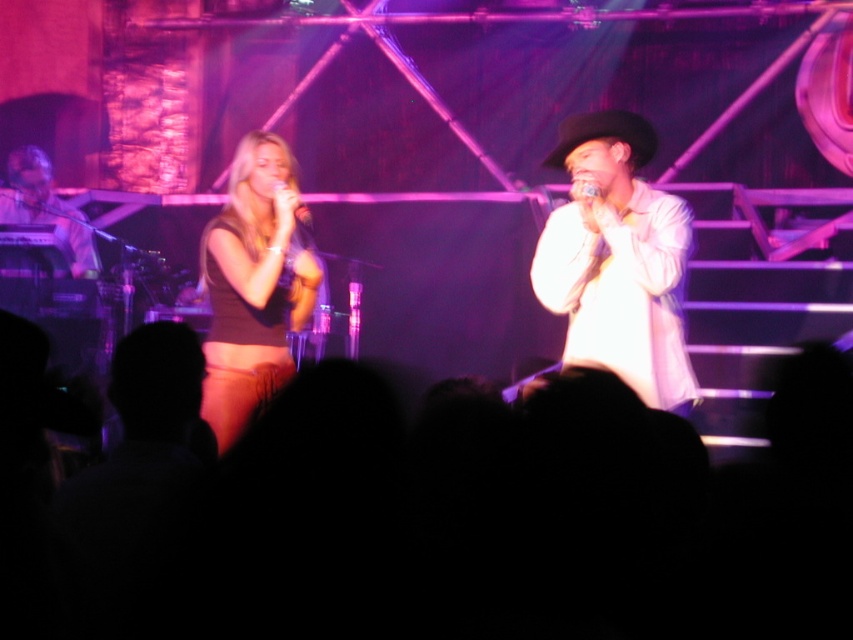
Question: Is white satin shirt at center closer to camera compared to metallic silver microphone at upper center?

Choices:
 (A) no
 (B) yes

Answer: (B)

Question: Among these points, which one is nearest to the camera?

Choices:
 (A) (277, 188)
 (B) (599, 188)
 (C) (682, 403)
 (D) (44, 160)

Answer: (C)

Question: Which of these objects is positioned closest to the metallic silver microphone at upper center?

Choices:
 (A) matte black microphone at left
 (B) matte black top at center

Answer: (B)

Question: Can you confirm if matte black microphone at left is positioned above matte black microphone at center?

Choices:
 (A) yes
 (B) no

Answer: (A)

Question: Which of the following is the closest to the observer?

Choices:
 (A) (225, 314)
 (B) (590, 184)

Answer: (B)

Question: Can you confirm if matte black top at center is positioned above matte black microphone at center?

Choices:
 (A) yes
 (B) no

Answer: (B)